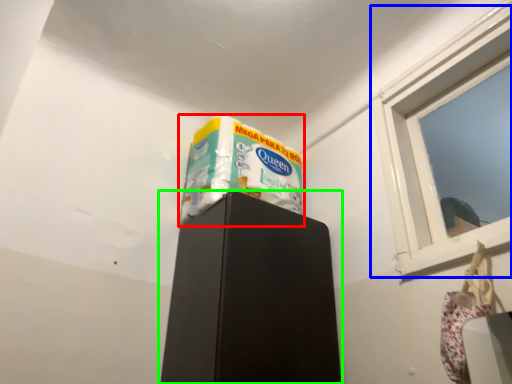
Question: Which object is positioned farthest from wrapping paper (highlighted by a red box)? Select from window (highlighted by a blue box) and furniture (highlighted by a green box).

Choices:
 (A) window
 (B) furniture

Answer: (A)